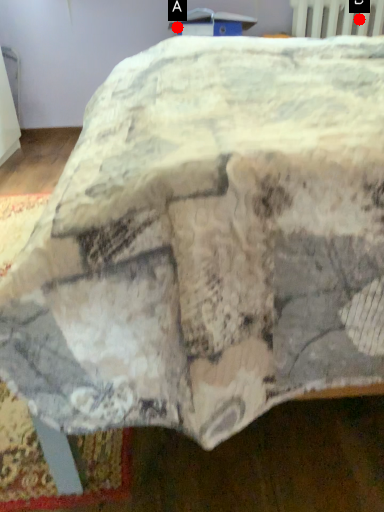
Question: Two points are circled on the image, labeled by A and B beside each circle. Which of the following is the closest to the observer?

Choices:
 (A) A is closer
 (B) B is closer

Answer: (B)